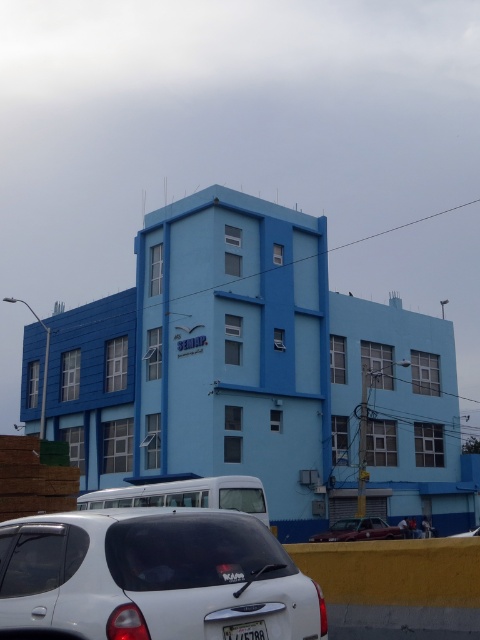
Is white matte hatchback at lower center positioned in front of shiny red car at center?

Yes.

Who is more distant from viewer, (254,604) or (389,531)?

Positioned behind is point (389,531).

Does point (118, 557) lie behind point (368, 522)?

No, (118, 557) is in front of (368, 522).

Find the location of a particular element. white matte hatchback at lower center is located at coordinates (154, 576).

Does white matte hatchback at lower center appear under white plastic license plate at lower center?

No, white matte hatchback at lower center is not below white plastic license plate at lower center.

Can you confirm if white matte hatchback at lower center is smaller than white plastic license plate at lower center?

No, white matte hatchback at lower center is not smaller than white plastic license plate at lower center.

Between point (243, 532) and point (247, 624), which one is positioned in front?

Point (247, 624)

Find the location of a particular element. white matte hatchback at lower center is located at coordinates (154, 576).

Consider the image. Can you confirm if shiny red car at center is thinner than metallic silver sedan at center?

Correct, shiny red car at center's width is less than metallic silver sedan at center's.

Between shiny red car at center and metallic silver sedan at center, which one has less height?

shiny red car at center is shorter.

Locate an element on the screen. The image size is (480, 640). shiny red car at center is located at coordinates (359, 531).